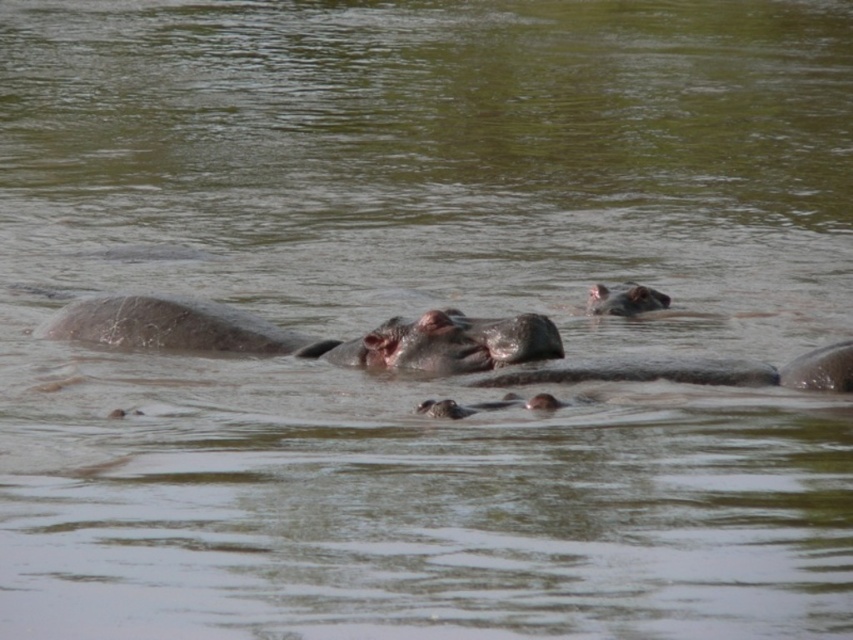
Question: Which object is farther from the camera taking this photo?

Choices:
 (A) gray matte hippo at upper center
 (B) smooth gray hippo mouth at center
 (C) gray matte hippo at center

Answer: (A)

Question: Which point is closer to the camera?

Choices:
 (A) (663, 296)
 (B) (434, 372)
 (C) (422, 328)
 (D) (94, 308)

Answer: (C)

Question: Is pink matte hippo at center behind gray matte hippo at upper center?

Choices:
 (A) no
 (B) yes

Answer: (A)

Question: Is gray matte hippo at center positioned before smooth gray hippo mouth at center?

Choices:
 (A) no
 (B) yes

Answer: (B)

Question: Does pink matte hippo at center come in front of smooth gray hippo mouth at center?

Choices:
 (A) no
 (B) yes

Answer: (B)

Question: Considering the real-world distances, which object is farthest from the smooth gray hippo mouth at center?

Choices:
 (A) gray matte hippo at upper center
 (B) pink matte hippo at center
 (C) gray matte hippo at center

Answer: (A)